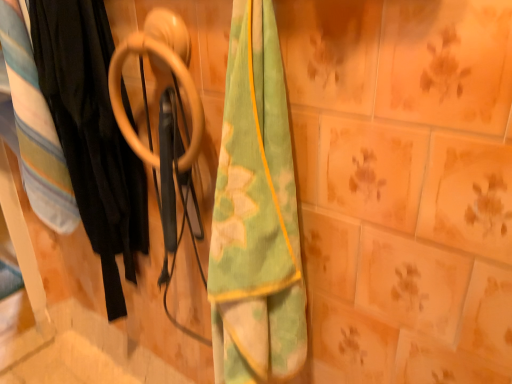
Question: Choose the correct answer: Is soft cotton blanket at left inside wooden ring at center or outside it?

Choices:
 (A) inside
 (B) outside

Answer: (B)

Question: From a real-world perspective, is soft cotton blanket at left positioned above or below wooden ring at center?

Choices:
 (A) above
 (B) below

Answer: (B)

Question: Considering the real-world distances, which object is farthest from the green/yellow fabric towel at center?

Choices:
 (A) soft cotton blanket at left
 (B) wooden ring at center
 (C) black fabric at left

Answer: (A)

Question: Which object is positioned farthest from the green/yellow fabric towel at center?

Choices:
 (A) wooden ring at center
 (B) black fabric at left
 (C) soft cotton blanket at left

Answer: (C)